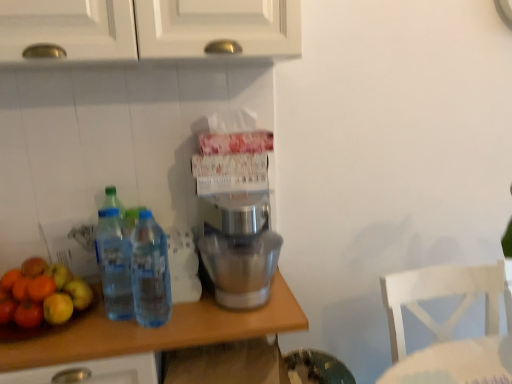
I want to click on vacant region in front of clear plastic bottles at center, the first bottle in the right-to-left sequence, so click(145, 339).